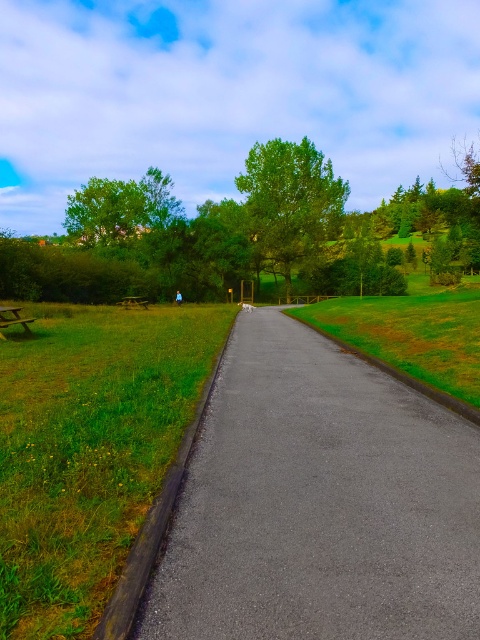
Question: Can you confirm if green grassy at center is positioned above wooden park bench at left?

Choices:
 (A) yes
 (B) no

Answer: (B)

Question: Which point is farther from the camera taking this photo?

Choices:
 (A) (141, 298)
 (B) (268, 262)
 (C) (267, 266)
 (D) (96, 472)

Answer: (C)

Question: Which object appears farthest from the camera in this image?

Choices:
 (A) green grassy at center
 (B) green leafy tree at center

Answer: (B)

Question: Is green leafy tree at center smaller than wooden picnic table at center?

Choices:
 (A) no
 (B) yes

Answer: (A)

Question: Which object is the farthest from the asphalt at center?

Choices:
 (A) green grassy at center
 (B) wooden picnic table at center

Answer: (B)

Question: Observing the image, what is the correct spatial positioning of green grassy at center in reference to green grass at center?

Choices:
 (A) right
 (B) left

Answer: (B)